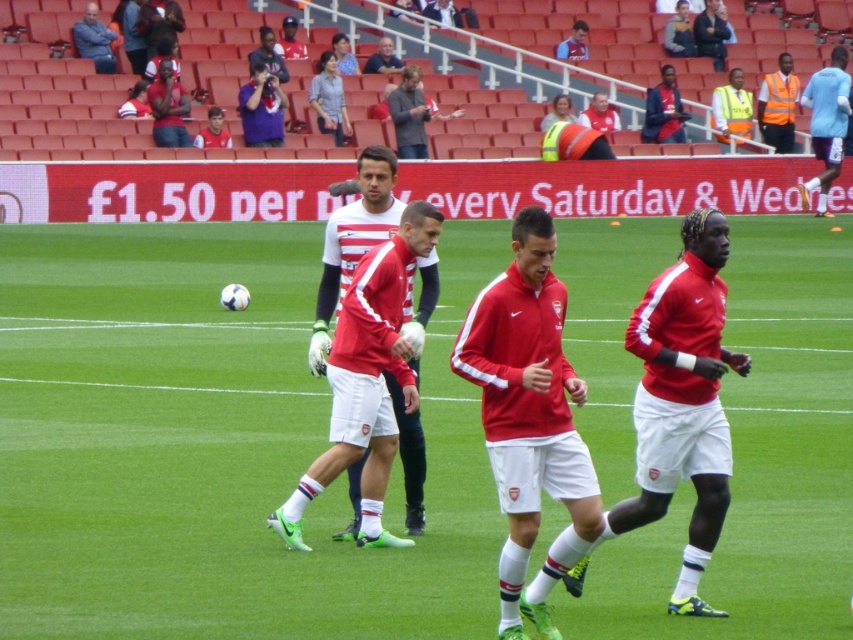
Does purple fabric camera at upper center have a greater height compared to high visibility vest at upper right?

No, purple fabric camera at upper center is not taller than high visibility vest at upper right.

From the picture: Who is positioned more to the left, purple fabric camera at upper center or high visibility vest at upper right?

From the viewer's perspective, purple fabric camera at upper center appears more on the left side.

Is point (268, 83) closer to viewer compared to point (787, 141)?

Yes, it is in front of point (787, 141).

This screenshot has width=853, height=640. Identify the location of purple fabric camera at upper center. (260, 108).

From the picture: Which of these two, matte red jersey at center or dark gray jacket at upper left, stands shorter?

Standing shorter between the two is dark gray jacket at upper left.

Does point (392, 376) come farther from viewer compared to point (105, 64)?

That is False.

What do you see at coordinates (352, 241) in the screenshot? I see `matte red jersey at center` at bounding box center [352, 241].

The image size is (853, 640). I want to click on matte red jersey at center, so click(x=352, y=241).

Who is taller, matte red jersey at center or purple fabric camera at upper center?

With more height is purple fabric camera at upper center.

Who is more distant from viewer, [347,209] or [247,84]?

The point [247,84] is more distant.

The height and width of the screenshot is (640, 853). Identify the location of matte red jersey at center. (352, 241).

This screenshot has width=853, height=640. I want to click on matte red jersey at center, so click(x=352, y=241).